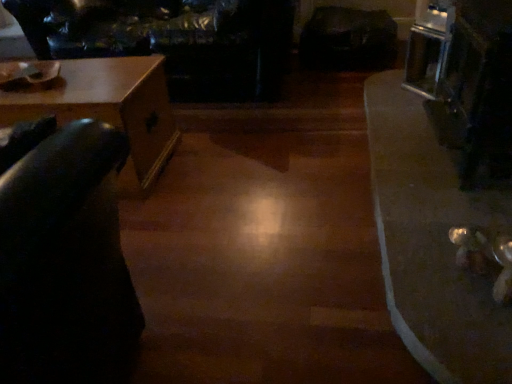
Question: Is wooden table at left, which is the second table from right to left, at the right side of shiny metallic table at lower right, placed as the second table when sorted from left to right?

Choices:
 (A) yes
 (B) no

Answer: (B)

Question: Is wooden table at left, the first table from the left, at the left side of shiny metallic table at lower right, placed as the second table when sorted from left to right?

Choices:
 (A) no
 (B) yes

Answer: (B)

Question: Is wooden table at left, the first table from the left, beside shiny metallic table at lower right, placed as the second table when sorted from left to right?

Choices:
 (A) no
 (B) yes

Answer: (A)

Question: From the image's perspective, is wooden table at left, the first table from the left, over shiny metallic table at lower right, placed as the second table when sorted from left to right?

Choices:
 (A) yes
 (B) no

Answer: (A)

Question: Does wooden table at left, the first table from the left, have a smaller size compared to shiny metallic table at lower right, the 1th table from the right?

Choices:
 (A) yes
 (B) no

Answer: (B)

Question: In terms of size, does wooden table at left, the first table from the left, appear bigger or smaller than leather couch at upper left?

Choices:
 (A) big
 (B) small

Answer: (B)

Question: In terms of width, does wooden table at left, the first table from the left, look wider or thinner when compared to leather couch at upper left?

Choices:
 (A) wide
 (B) thin

Answer: (B)

Question: From their relative heights in the image, would you say wooden table at left, the first table from the left, is taller or shorter than leather couch at upper left?

Choices:
 (A) tall
 (B) short

Answer: (B)

Question: In the image, is wooden table at left, which is the second table from right to left, positioned in front of or behind leather couch at upper left?

Choices:
 (A) behind
 (B) front

Answer: (B)

Question: In terms of width, does shiny metallic table at lower right, placed as the second table when sorted from left to right, look wider or thinner when compared to wooden table at left, the first table from the left?

Choices:
 (A) wide
 (B) thin

Answer: (B)

Question: Is shiny metallic table at lower right, placed as the second table when sorted from left to right, taller or shorter than wooden table at left, the first table from the left?

Choices:
 (A) tall
 (B) short

Answer: (B)

Question: Is shiny metallic table at lower right, the 1th table from the right, inside or outside of wooden table at left, which is the second table from right to left?

Choices:
 (A) inside
 (B) outside

Answer: (B)

Question: Does point (372, 183) appear closer or farther from the camera than point (164, 89)?

Choices:
 (A) farther
 (B) closer

Answer: (B)

Question: Considering the positions of leather couch at upper left and wooden table at left, which is the second table from right to left, in the image, is leather couch at upper left bigger or smaller than wooden table at left, which is the second table from right to left,?

Choices:
 (A) big
 (B) small

Answer: (A)

Question: Considering the relative positions of leather couch at upper left and wooden table at left, which is the second table from right to left, in the image provided, is leather couch at upper left to the left or to the right of wooden table at left, which is the second table from right to left,?

Choices:
 (A) right
 (B) left

Answer: (A)